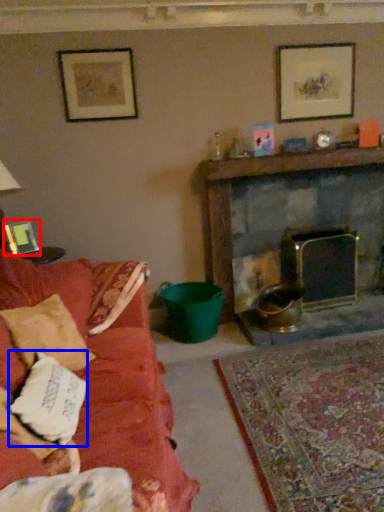
Question: Which point is further to the camera, picture frame (highlighted by a red box) or pillow (highlighted by a blue box)?

Choices:
 (A) picture frame
 (B) pillow

Answer: (A)